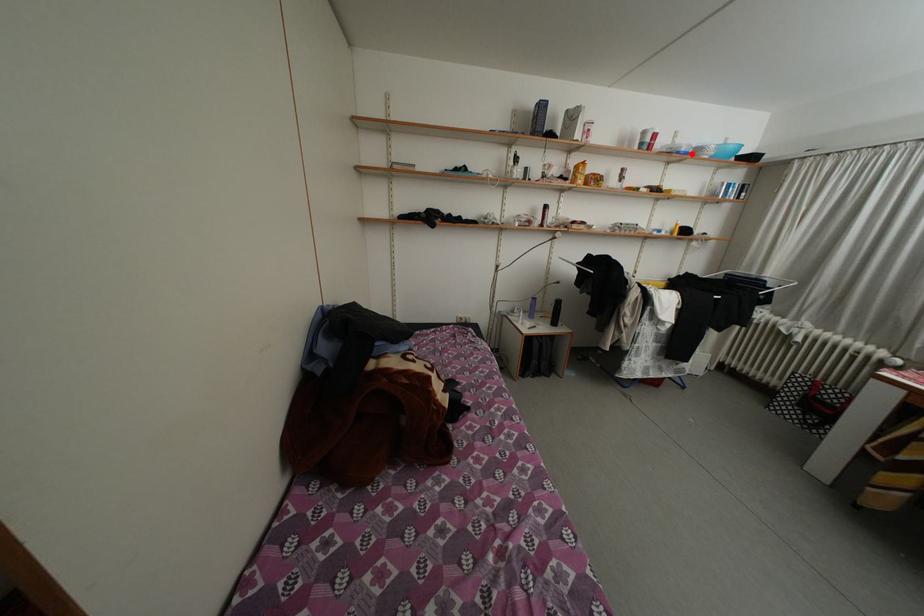
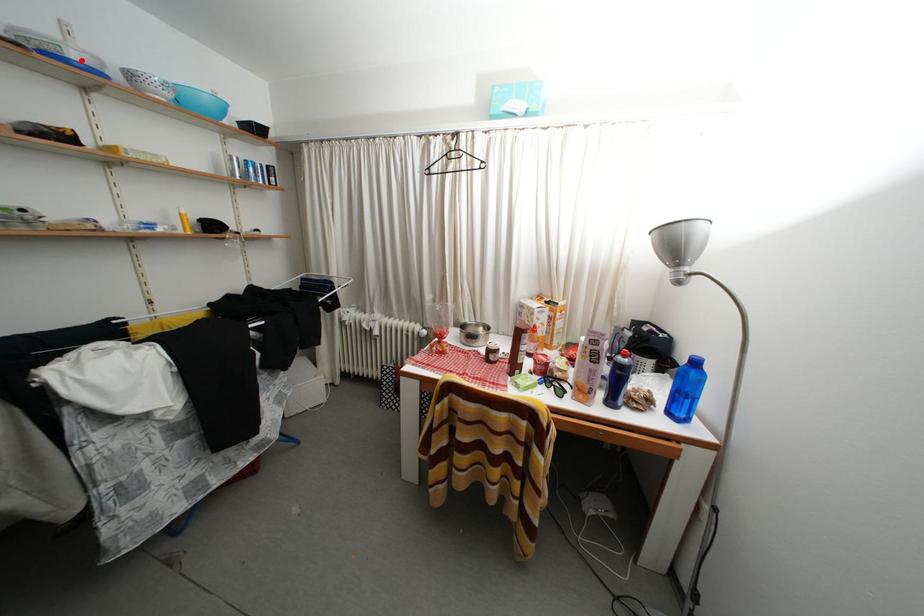
I am providing you with two images of the same scene from different viewpoints. A red point is marked on the first image and another point is marked on the second image. Does the point marked in image1 correspond to the same location as the one in image2?

Yes